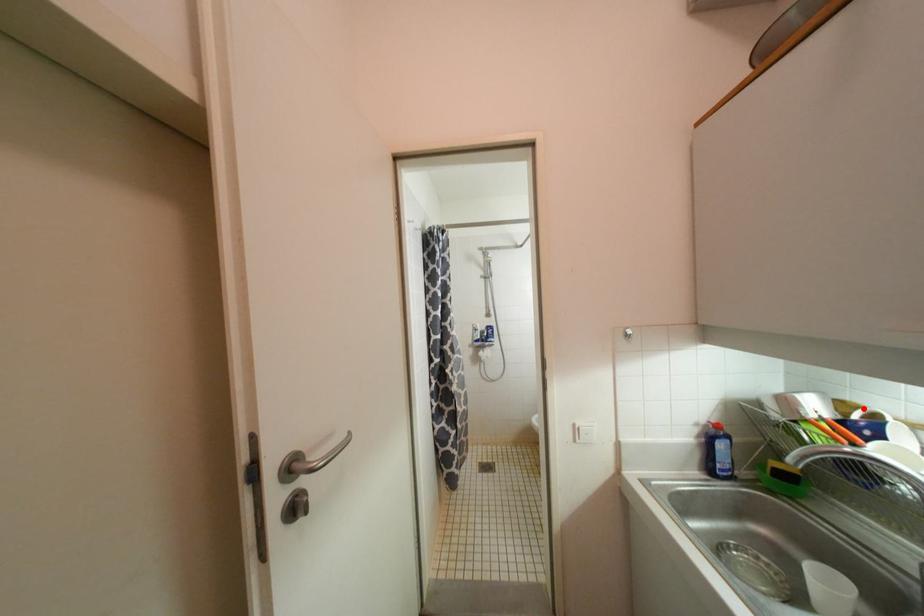
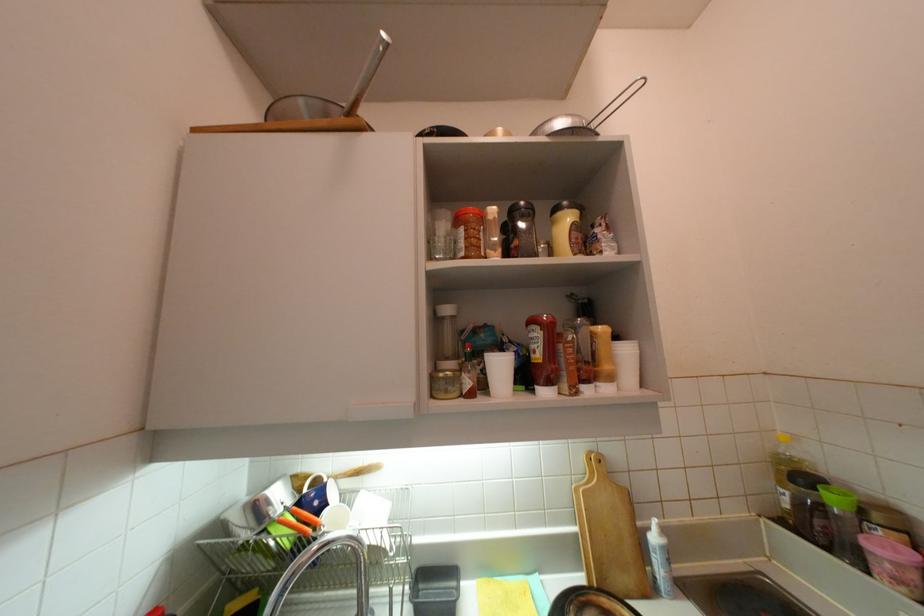
Locate, in the second image, the point that corresponds to the highlighted location in the first image.

(311, 477)